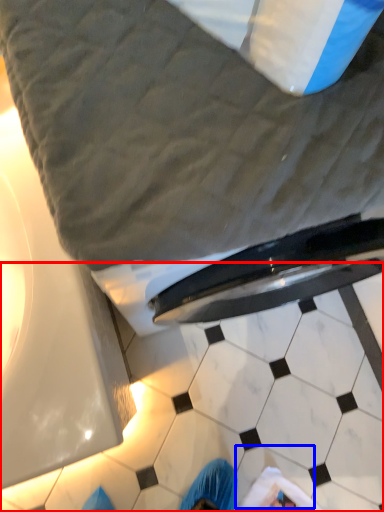
Question: Which object appears closest to the camera in this image, tile (highlighted by a red box) or tile (highlighted by a blue box)?

Choices:
 (A) tile
 (B) tile

Answer: (A)